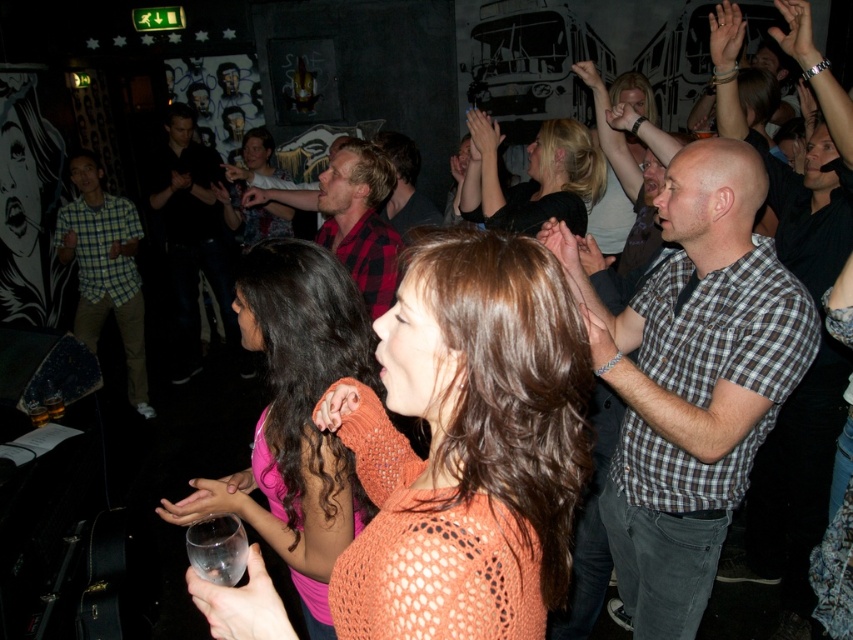
You are a photographer at the nightclub and want to take a photo of the black matte shirt at center and the blonde hair at center. Which object should you focus on first if you want to ensure both are in focus without adjusting the camera settings?

The black matte shirt at center is much taller than the blonde hair at center, so focusing on the black matte shirt at center first would ensure both are in focus since it is farther away and has a larger depth of field.

Based on the photo, you are a photographer planning to take a group photo of the people in the nightclub scene. You need to ensure that both the checkered fabric shirt at left and the red plaid shirt at center are visible in the frame. Given their sizes, which shirt should you position closer to the camera to maintain their visibility in the photo?

The checkered fabric shirt at left is larger in width than the red plaid shirt at center. To maintain visibility, position the smaller red plaid shirt at center closer to the camera so it appears similar in size to the larger checkered fabric shirt at left in the photo.